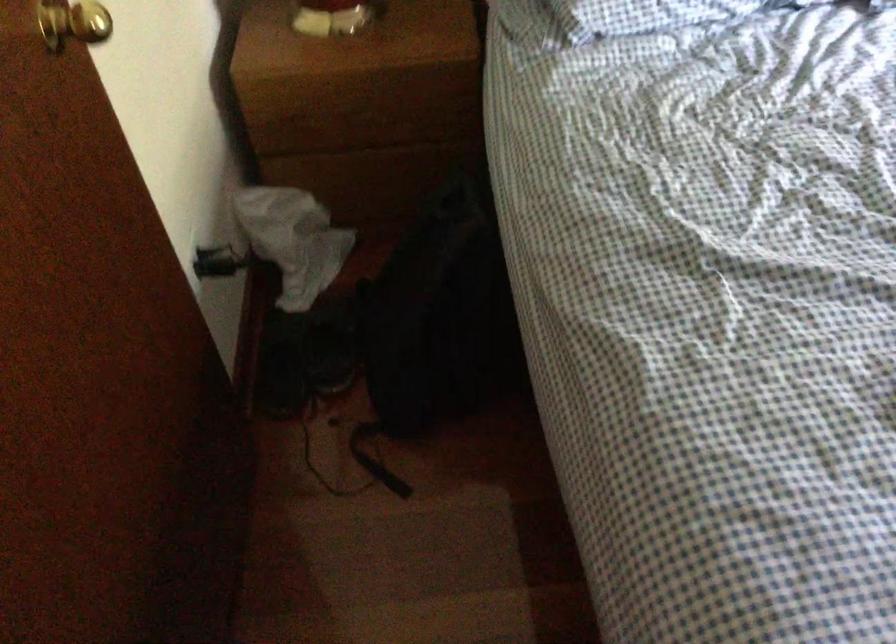
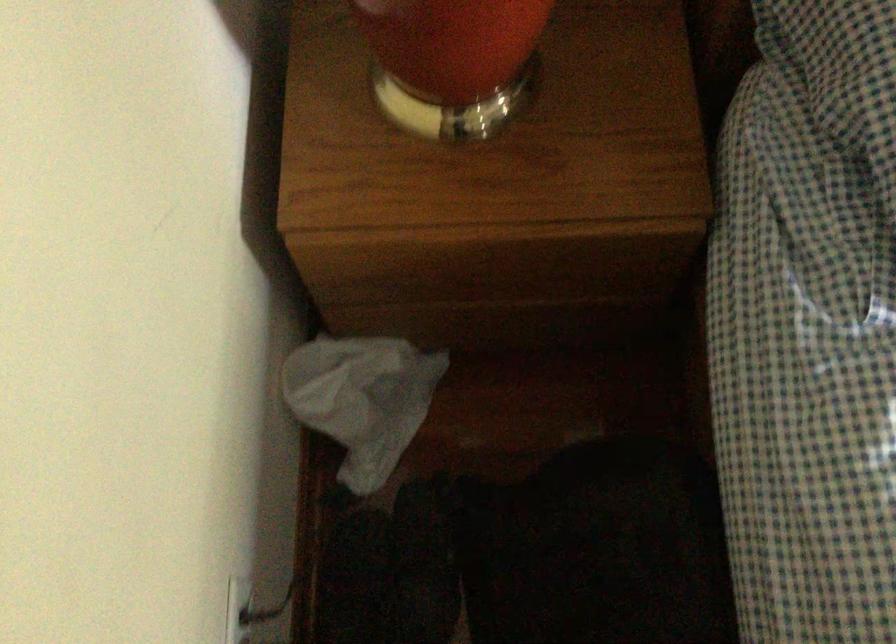
Which direction would the cameraman need to move to produce the second image?

The cameraman walked toward left, forward.